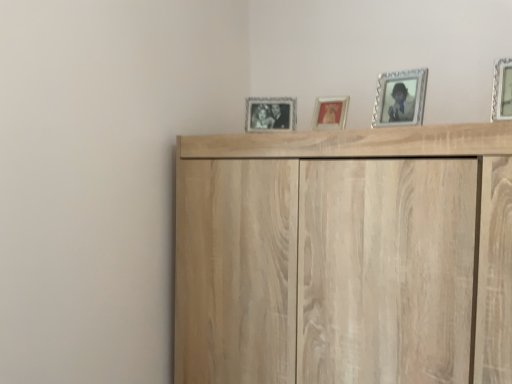
Question: Would you say silver textured picture frame at upper right, marked as the third picture frame in a left-to-right arrangement, is inside or outside metallic silver picture frame at center, which is the 2th picture frame from left to right?

Choices:
 (A) inside
 (B) outside

Answer: (B)

Question: In terms of width, does silver textured picture frame at upper right, which is counted as the 3th picture frame, starting from the back, look wider or thinner when compared to metallic silver picture frame at center, the 3th picture frame from the front?

Choices:
 (A) wide
 (B) thin

Answer: (A)

Question: Which is nearer to the black and white photo frame at center, the 4th picture frame viewed from the front?

Choices:
 (A) light wood cupboard at upper center
 (B) metallic silver picture frame at center, the 2th picture frame positioned from the back
 (C) silver metallic picture frame at upper right, the 4th picture frame from the back
 (D) silver textured picture frame at upper right, which is the second picture frame in right-to-left order

Answer: (B)

Question: Which object is the farthest from the light wood cupboard at upper center?

Choices:
 (A) silver textured picture frame at upper right, marked as the third picture frame in a left-to-right arrangement
 (B) black and white photo frame at center, arranged as the first picture frame when viewed from the back
 (C) silver metallic picture frame at upper right, which is counted as the 1th picture frame, starting from the front
 (D) metallic silver picture frame at center, the 2th picture frame positioned from the back

Answer: (C)